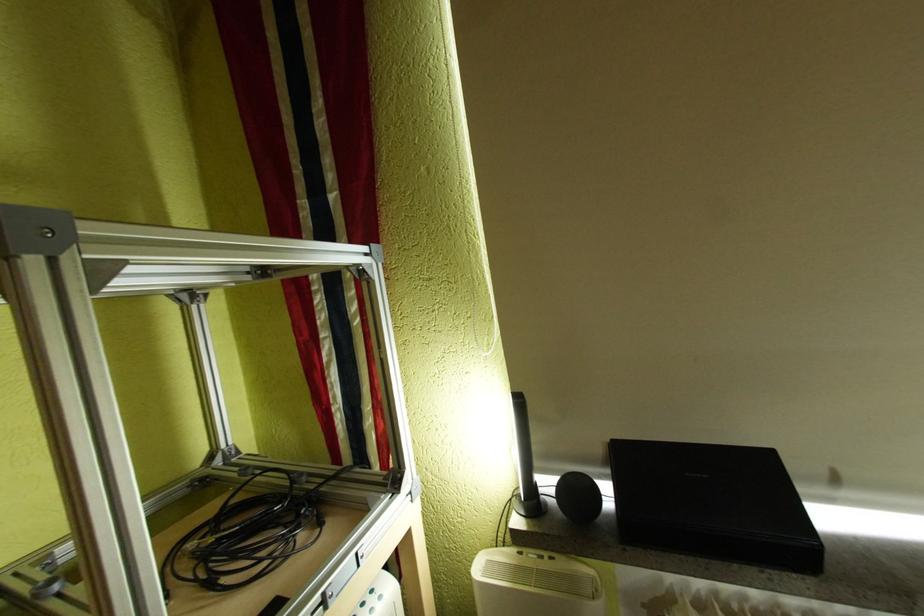
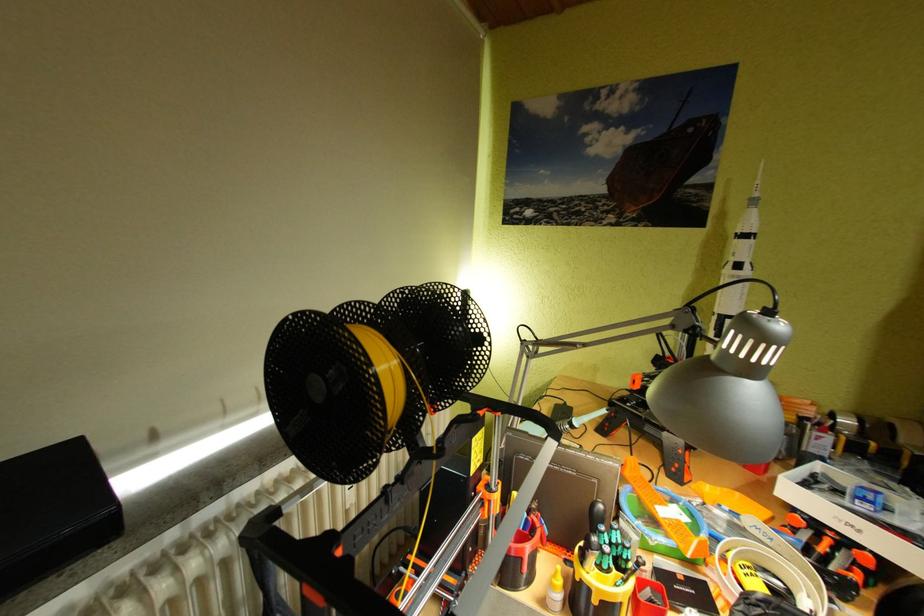
Question: Based on the continuous images, in which direction is the camera rotating? Reply with the corresponding letter.

Choices:
 (A) Left
 (B) Right
 (C) Up
 (D) Down

Answer: (B)